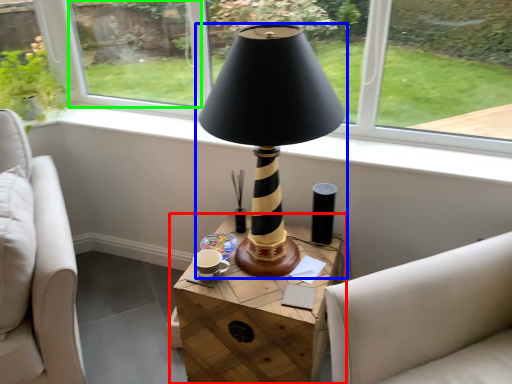
Question: Based on their relative distances, which object is nearer to table (highlighted by a red box)? Choose from lamp (highlighted by a blue box) and window screen (highlighted by a green box).

Choices:
 (A) lamp
 (B) window screen

Answer: (A)